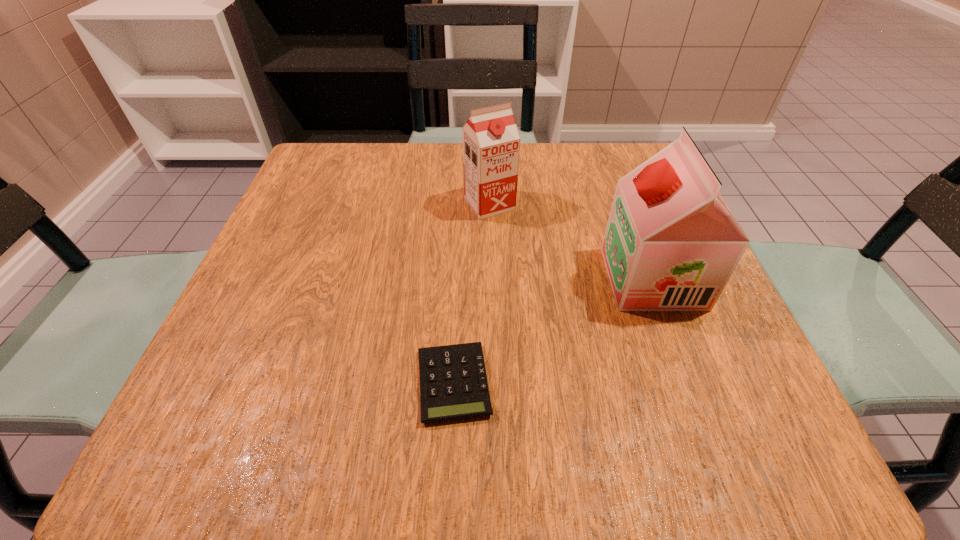
You are a GUI agent. You are given a task and a screenshot of the screen. Output one action in this format:
    pyautogui.click(x=<x>, y=<y>)
    Task: Click on the right soya milk
    The image size is (960, 540).
    Given the screenshot: What is the action you would take?
    pyautogui.click(x=671, y=243)

This screenshot has width=960, height=540. I want to click on the nearer soya milk, so click(x=671, y=243).

At what (x,y) coordinates should I click in order to perform the action: click on the farthest object. Please return your answer as a coordinate pair (x, y). The height and width of the screenshot is (540, 960). Looking at the image, I should click on (491, 142).

Identify the location of the shorter soya milk. (491, 142).

You are a GUI agent. You are given a task and a screenshot of the screen. Output one action in this format:
    pyautogui.click(x=<x>, y=<y>)
    Task: Click on the calculator
    This screenshot has width=960, height=540.
    Given the screenshot: What is the action you would take?
    pos(453,383)

Locate an element on the screen. Image resolution: width=960 pixels, height=540 pixels. the shortest object is located at coordinates (453, 383).

I want to click on free space located with the cap open on the right soya milk, so click(x=502, y=278).

At what (x,y) coordinates should I click in order to perform the action: click on free region located 0.220m with the cap open on the right soya milk. Please return your answer as a coordinate pair (x, y). The height and width of the screenshot is (540, 960). Looking at the image, I should click on (485, 278).

Locate an element on the screen. free region located with the cap open on the right soya milk is located at coordinates (536, 278).

The width and height of the screenshot is (960, 540). I want to click on free region located 0.320m on the right of the left soya milk, so click(666, 204).